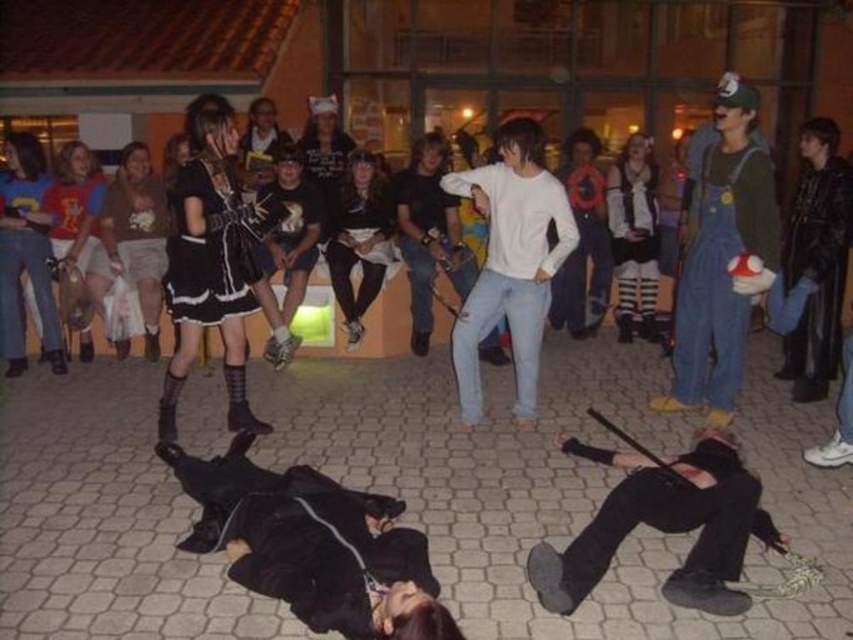
Which is above, black leather jacket at lower center or black leather pants at lower center?

black leather pants at lower center is above.

Is black leather jacket at lower center positioned at the back of black leather pants at lower center?

No, black leather jacket at lower center is in front of black leather pants at lower center.

This screenshot has width=853, height=640. What do you see at coordinates (312, 545) in the screenshot?
I see `black leather jacket at lower center` at bounding box center [312, 545].

At what (x,y) coordinates should I click in order to perform the action: click on black leather jacket at lower center. Please return your answer as a coordinate pair (x, y). Image resolution: width=853 pixels, height=640 pixels. Looking at the image, I should click on (312, 545).

Is point (700, 304) positioned behind point (505, 252)?

Yes, it is.

Between denim overalls at center right and white cotton shirt at center, which one has less height?

white cotton shirt at center

Is point (727, 275) closer to camera compared to point (459, 189)?

Yes.

This screenshot has width=853, height=640. I want to click on denim overalls at center right, so click(x=722, y=259).

Is black leather pants at lower center smaller than denim overalls at center right?

Yes, black leather pants at lower center is smaller than denim overalls at center right.

Can you confirm if black leather pants at lower center is thinner than denim overalls at center right?

No.

The image size is (853, 640). Find the location of `black leather pants at lower center`. black leather pants at lower center is located at coordinates (664, 525).